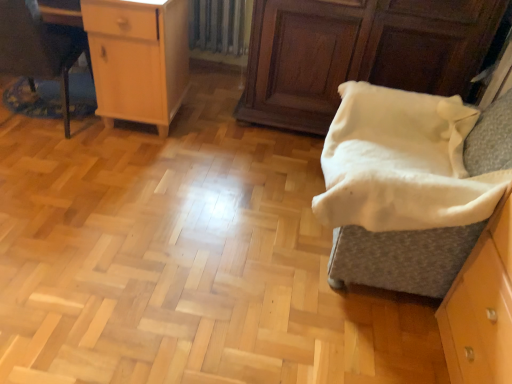
I want to click on unoccupied region to the right of brushed metal desk at left, so click(x=118, y=147).